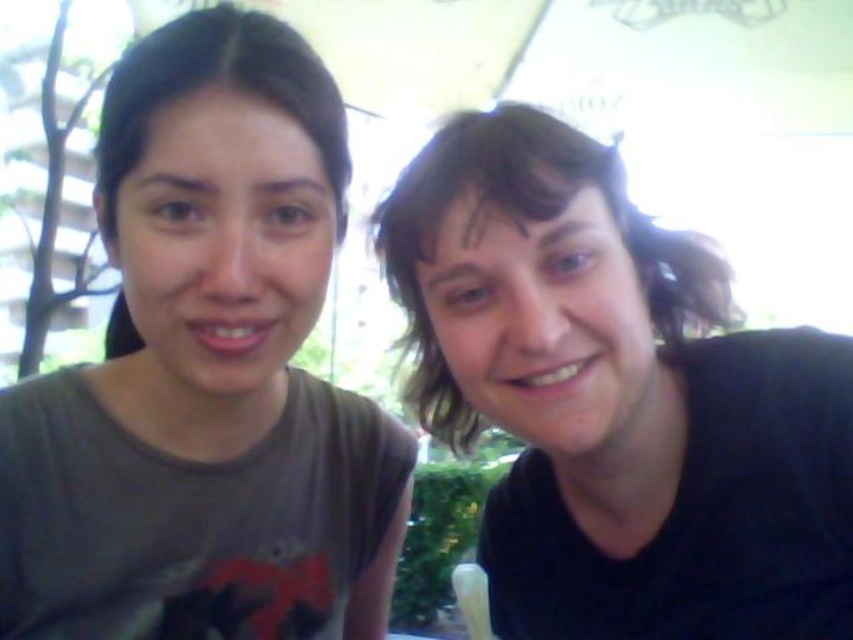
Is point (21, 547) positioned in front of point (461, 182)?

No, it is not.

Which is behind, point (212, 156) or point (473, 179)?

The point (212, 156) is behind.

Find the location of `gray matte t-shirt at left`. gray matte t-shirt at left is located at coordinates (207, 372).